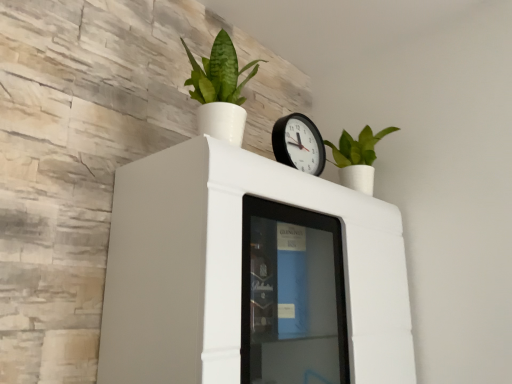
Question: Can you confirm if black plastic wall clock at upper center is wider than green matte plant at upper right, placed as the first houseplant when sorted from back to front?

Choices:
 (A) no
 (B) yes

Answer: (A)

Question: Would you say black plastic wall clock at upper center is outside green matte plant at upper right, which is the first houseplant in right-to-left order?

Choices:
 (A) no
 (B) yes

Answer: (B)

Question: From a real-world perspective, is black plastic wall clock at upper center on green matte plant at upper right, the second houseplant viewed from the left?

Choices:
 (A) yes
 (B) no

Answer: (B)

Question: Is black plastic wall clock at upper center touching green matte plant at upper right, placed as the first houseplant when sorted from back to front?

Choices:
 (A) yes
 (B) no

Answer: (B)

Question: Considering the relative sizes of black plastic wall clock at upper center and green matte plant at upper right, positioned as the second houseplant in front-to-back order, in the image provided, is black plastic wall clock at upper center taller than green matte plant at upper right, positioned as the second houseplant in front-to-back order,?

Choices:
 (A) yes
 (B) no

Answer: (B)

Question: Is black plastic wall clock at upper center shorter than green matte plant at upper right, placed as the first houseplant when sorted from back to front?

Choices:
 (A) yes
 (B) no

Answer: (A)

Question: Is green matte plant at upper right, positioned as the second houseplant in front-to-back order, completely or partially outside of white glossy cabinet at upper center?

Choices:
 (A) yes
 (B) no

Answer: (A)

Question: From the image's perspective, is green matte plant at upper right, the second houseplant viewed from the left, located beneath white glossy cabinet at upper center?

Choices:
 (A) yes
 (B) no

Answer: (B)

Question: Are green matte plant at upper right, placed as the first houseplant when sorted from back to front, and white glossy cabinet at upper center making contact?

Choices:
 (A) no
 (B) yes

Answer: (A)

Question: Can you confirm if green matte plant at upper right, which is the first houseplant in right-to-left order, is bigger than white glossy cabinet at upper center?

Choices:
 (A) yes
 (B) no

Answer: (B)

Question: Is the position of green matte plant at upper right, the second houseplant viewed from the left, less distant than that of white glossy cabinet at upper center?

Choices:
 (A) yes
 (B) no

Answer: (B)

Question: Is green matte plant at upper right, the second houseplant viewed from the left, smaller than white glossy cabinet at upper center?

Choices:
 (A) yes
 (B) no

Answer: (A)

Question: Considering the relative sizes of green matte plant at upper center, placed as the 2th houseplant when sorted from right to left, and white glossy cabinet at upper center in the image provided, is green matte plant at upper center, placed as the 2th houseplant when sorted from right to left, wider than white glossy cabinet at upper center?

Choices:
 (A) yes
 (B) no

Answer: (B)